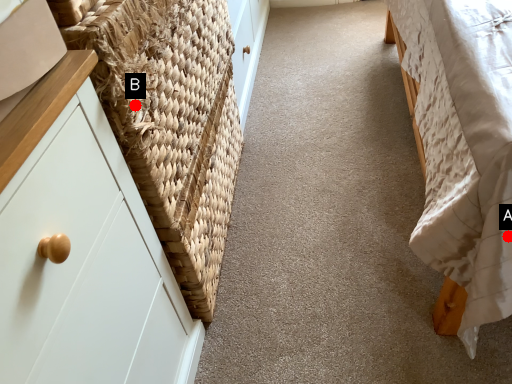
Question: Two points are circled on the image, labeled by A and B beside each circle. Which point is farther to the camera?

Choices:
 (A) A is further
 (B) B is further

Answer: (B)